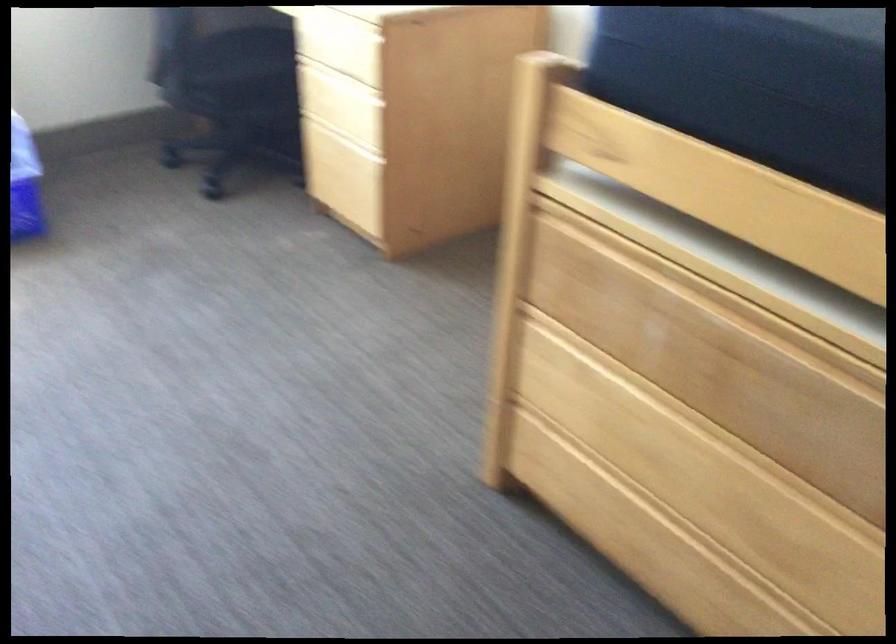
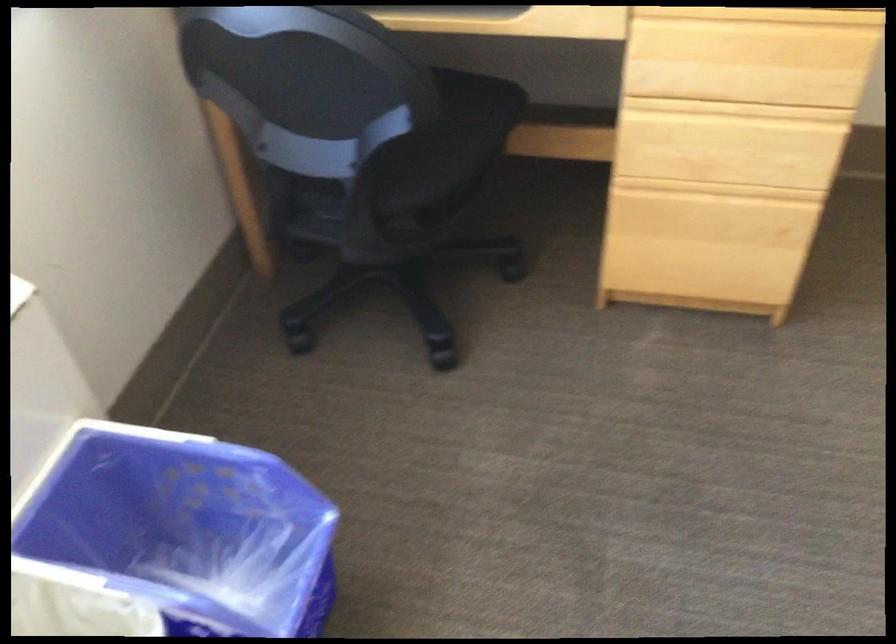
The point at [346,76] is marked in the first image. Where is the corresponding point in the second image?

(736, 109)